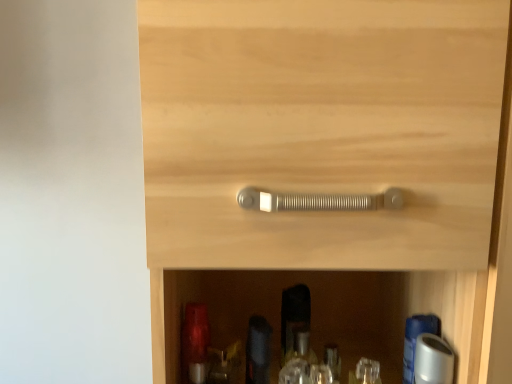
Identify the location of white glossy bottle at lower right, placed as the first bottle when sorted from right to left. The width and height of the screenshot is (512, 384). (415, 340).

What are the coordinates of `matte red glass bottle at lower left, the first bottle from the left` in the screenshot? It's located at (194, 338).

Would you consider clear plastic bottle at lower center, the second bottle in the right-to-left sequence, to be distant from matte black bottle at lower center, placed as the third bottle when sorted from right to left?

No, clear plastic bottle at lower center, the second bottle in the right-to-left sequence, is not far from matte black bottle at lower center, placed as the third bottle when sorted from right to left.

From a real-world perspective, between clear plastic bottle at lower center, the third bottle from the left, and matte black bottle at lower center, placed as the third bottle when sorted from right to left, who is vertically lower?

clear plastic bottle at lower center, the third bottle from the left, from a real-world perspective.

From the image's perspective, which is below, clear plastic bottle at lower center, the second bottle in the right-to-left sequence, or matte black bottle at lower center, which is the 2th bottle in left-to-right order?

clear plastic bottle at lower center, the second bottle in the right-to-left sequence, from the image's perspective.

In order to click on bottle that is the 2nd one when counting upward from the clear plastic bottle at lower center, the third bottle from the left (from the image's perspective) in this screenshot , I will do `click(258, 350)`.

From a real-world perspective, is matte silver handle at center above or below matte black bottle at lower center, which is the 2th bottle in left-to-right order?

From a real-world perspective, matte silver handle at center is physically above matte black bottle at lower center, which is the 2th bottle in left-to-right order.

Which object is positioned more to the left, matte silver handle at center or matte black bottle at lower center, which is the 2th bottle in left-to-right order?

matte black bottle at lower center, which is the 2th bottle in left-to-right order, is more to the left.

Which of these two, matte silver handle at center or matte black bottle at lower center, placed as the third bottle when sorted from right to left, is wider?

matte silver handle at center.

Considering the relative sizes of matte silver handle at center and matte black bottle at lower center, placed as the third bottle when sorted from right to left, in the image provided, is matte silver handle at center smaller than matte black bottle at lower center, placed as the third bottle when sorted from right to left,?

No, matte silver handle at center is not smaller than matte black bottle at lower center, placed as the third bottle when sorted from right to left.

Between matte red glass bottle at lower left, which is the 4th bottle from right to left, and matte silver handle at center, which one is positioned in front?

matte silver handle at center.

Can you confirm if matte red glass bottle at lower left, which is the 4th bottle from right to left, is smaller than matte silver handle at center?

Indeed, matte red glass bottle at lower left, which is the 4th bottle from right to left, has a smaller size compared to matte silver handle at center.

What's the angular difference between matte red glass bottle at lower left, which is the 4th bottle from right to left, and matte silver handle at center's facing directions?

0.662 degrees.

Which of these two, matte red glass bottle at lower left, which is the 4th bottle from right to left, or matte silver handle at center, is thinner?

matte red glass bottle at lower left, which is the 4th bottle from right to left.

Is matte black bottle at lower center, placed as the third bottle when sorted from right to left, inside or outside of clear plastic bottle at lower center, the second bottle in the right-to-left sequence?

matte black bottle at lower center, placed as the third bottle when sorted from right to left, exists outside the volume of clear plastic bottle at lower center, the second bottle in the right-to-left sequence.

Between matte black bottle at lower center, placed as the third bottle when sorted from right to left, and clear plastic bottle at lower center, the third bottle from the left, which one has less height?

clear plastic bottle at lower center, the third bottle from the left, is shorter.

Is matte black bottle at lower center, placed as the third bottle when sorted from right to left, aimed at clear plastic bottle at lower center, the third bottle from the left?

No, matte black bottle at lower center, placed as the third bottle when sorted from right to left, is not turned towards clear plastic bottle at lower center, the third bottle from the left.

Measure the distance from matte black bottle at lower center, which is the 2th bottle in left-to-right order, to clear plastic bottle at lower center, the second bottle in the right-to-left sequence.

matte black bottle at lower center, which is the 2th bottle in left-to-right order, and clear plastic bottle at lower center, the second bottle in the right-to-left sequence, are 3.03 inches apart.

Is matte red glass bottle at lower left, which is the 4th bottle from right to left, outside of clear plastic bottle at lower center, the third bottle from the left?

Yes, matte red glass bottle at lower left, which is the 4th bottle from right to left, is located beyond the bounds of clear plastic bottle at lower center, the third bottle from the left.

Between matte red glass bottle at lower left, which is the 4th bottle from right to left, and clear plastic bottle at lower center, the second bottle in the right-to-left sequence, which one has smaller size?

clear plastic bottle at lower center, the second bottle in the right-to-left sequence.

You are a GUI agent. You are given a task and a screenshot of the screen. Output one action in this format:
    pyautogui.click(x=<x>, y=<y>)
    Task: Click on the bottle below the matte red glass bottle at lower left, which is the 4th bottle from right to left (from a real-world perspective)
    
    Given the screenshot: What is the action you would take?
    pyautogui.click(x=298, y=358)

Considering the relative positions of matte red glass bottle at lower left, the first bottle from the left, and clear plastic bottle at lower center, the second bottle in the right-to-left sequence, in the image provided, is matte red glass bottle at lower left, the first bottle from the left, behind clear plastic bottle at lower center, the second bottle in the right-to-left sequence,?

No, it is not.

Which of these two, clear plastic bottle at lower center, the second bottle in the right-to-left sequence, or matte silver handle at center, is wider?

With larger width is matte silver handle at center.

At what (x,y) coordinates should I click in order to perform the action: click on cupboard in front of the clear plastic bottle at lower center, the second bottle in the right-to-left sequence. Please return your answer as a coordinate pair (x, y). The height and width of the screenshot is (384, 512). Looking at the image, I should click on (328, 142).

Between clear plastic bottle at lower center, the second bottle in the right-to-left sequence, and matte silver handle at center, which one has more height?

With more height is matte silver handle at center.

From the image's perspective, which is above, clear plastic bottle at lower center, the third bottle from the left, or matte silver handle at center?

From the image's view, matte silver handle at center is above.

Consider the image. Considering the relative sizes of matte silver handle at center and matte red glass bottle at lower left, which is the 4th bottle from right to left, in the image provided, is matte silver handle at center smaller than matte red glass bottle at lower left, which is the 4th bottle from right to left,?

No, matte silver handle at center is not smaller than matte red glass bottle at lower left, which is the 4th bottle from right to left.

Which of these two, matte silver handle at center or matte red glass bottle at lower left, which is the 4th bottle from right to left, stands shorter?

matte red glass bottle at lower left, which is the 4th bottle from right to left, is shorter.

Considering the relative positions of matte silver handle at center and matte red glass bottle at lower left, which is the 4th bottle from right to left, in the image provided, is matte silver handle at center to the right of matte red glass bottle at lower left, which is the 4th bottle from right to left, from the viewer's perspective?

Yes, matte silver handle at center is to the right of matte red glass bottle at lower left, which is the 4th bottle from right to left.

Is matte silver handle at center in front of matte red glass bottle at lower left, which is the 4th bottle from right to left?

Yes, matte silver handle at center is closer to the camera.

Where is `the 3rd bottle behind the matte black bottle at lower center, placed as the third bottle when sorted from right to left`? The image size is (512, 384). the 3rd bottle behind the matte black bottle at lower center, placed as the third bottle when sorted from right to left is located at coordinates (298, 358).

You are a GUI agent. You are given a task and a screenshot of the screen. Output one action in this format:
    pyautogui.click(x=<x>, y=<y>)
    Task: Click on the cupboard on the right of the matte black bottle at lower center, which is the 2th bottle in left-to-right order
    Image resolution: width=512 pixels, height=384 pixels.
    Given the screenshot: What is the action you would take?
    pyautogui.click(x=328, y=142)

Based on their spatial positions, is matte silver handle at center or matte black bottle at lower center, placed as the third bottle when sorted from right to left, closer to clear plastic bottle at lower center, the second bottle in the right-to-left sequence?

Among the two, matte black bottle at lower center, placed as the third bottle when sorted from right to left, is located nearer to clear plastic bottle at lower center, the second bottle in the right-to-left sequence.

Estimate the real-world distances between objects in this image. Which object is further from white glossy bottle at lower right, placed as the first bottle when sorted from right to left, matte black bottle at lower center, placed as the third bottle when sorted from right to left, or matte red glass bottle at lower left, which is the 4th bottle from right to left?

matte red glass bottle at lower left, which is the 4th bottle from right to left, is positioned further to the anchor white glossy bottle at lower right, placed as the first bottle when sorted from right to left.

When comparing their distances from matte silver handle at center, does white glossy bottle at lower right, arranged as the 4th bottle when viewed from the left, or matte red glass bottle at lower left, the first bottle from the left, seem closer?

The object closer to matte silver handle at center is white glossy bottle at lower right, arranged as the 4th bottle when viewed from the left.

Which object lies nearer to the anchor point matte red glass bottle at lower left, which is the 4th bottle from right to left, white glossy bottle at lower right, placed as the first bottle when sorted from right to left, or clear plastic bottle at lower center, the second bottle in the right-to-left sequence?

clear plastic bottle at lower center, the second bottle in the right-to-left sequence, lies closer to matte red glass bottle at lower left, which is the 4th bottle from right to left, than the other object.

Looking at the image, which one is located further to matte silver handle at center, white glossy bottle at lower right, arranged as the 4th bottle when viewed from the left, or clear plastic bottle at lower center, the second bottle in the right-to-left sequence?

Among the two, clear plastic bottle at lower center, the second bottle in the right-to-left sequence, is located further to matte silver handle at center.

When comparing their distances from clear plastic bottle at lower center, the third bottle from the left, does white glossy bottle at lower right, placed as the first bottle when sorted from right to left, or matte red glass bottle at lower left, the first bottle from the left, seem further?

white glossy bottle at lower right, placed as the first bottle when sorted from right to left, is positioned further to the anchor clear plastic bottle at lower center, the third bottle from the left.

Looking at this image, from the image, which object appears to be farther from matte silver handle at center, white glossy bottle at lower right, placed as the first bottle when sorted from right to left, or matte black bottle at lower center, placed as the third bottle when sorted from right to left?

white glossy bottle at lower right, placed as the first bottle when sorted from right to left, is further to matte silver handle at center.

From the image, which object appears to be farther from white glossy bottle at lower right, arranged as the 4th bottle when viewed from the left, clear plastic bottle at lower center, the third bottle from the left, or matte silver handle at center?

The object further to white glossy bottle at lower right, arranged as the 4th bottle when viewed from the left, is matte silver handle at center.

You are a GUI agent. You are given a task and a screenshot of the screen. Output one action in this format:
    pyautogui.click(x=<x>, y=<y>)
    Task: Click on the bottle between matte black bottle at lower center, placed as the third bottle when sorted from right to left, and white glossy bottle at lower right, placed as the first bottle when sorted from right to left, from left to right
    The image size is (512, 384).
    Given the screenshot: What is the action you would take?
    pyautogui.click(x=298, y=358)

Identify the location of cupboard situated between matte red glass bottle at lower left, which is the 4th bottle from right to left, and white glossy bottle at lower right, placed as the first bottle when sorted from right to left, from left to right. (328, 142).

At what (x,y) coordinates should I click in order to perform the action: click on bottle between matte red glass bottle at lower left, which is the 4th bottle from right to left, and clear plastic bottle at lower center, the second bottle in the right-to-left sequence, from left to right. Please return your answer as a coordinate pair (x, y). This screenshot has width=512, height=384. Looking at the image, I should click on pos(258,350).

Locate an element on the screen. This screenshot has width=512, height=384. cupboard located between matte black bottle at lower center, which is the 2th bottle in left-to-right order, and white glossy bottle at lower right, placed as the first bottle when sorted from right to left, in the left-right direction is located at coordinates (328, 142).